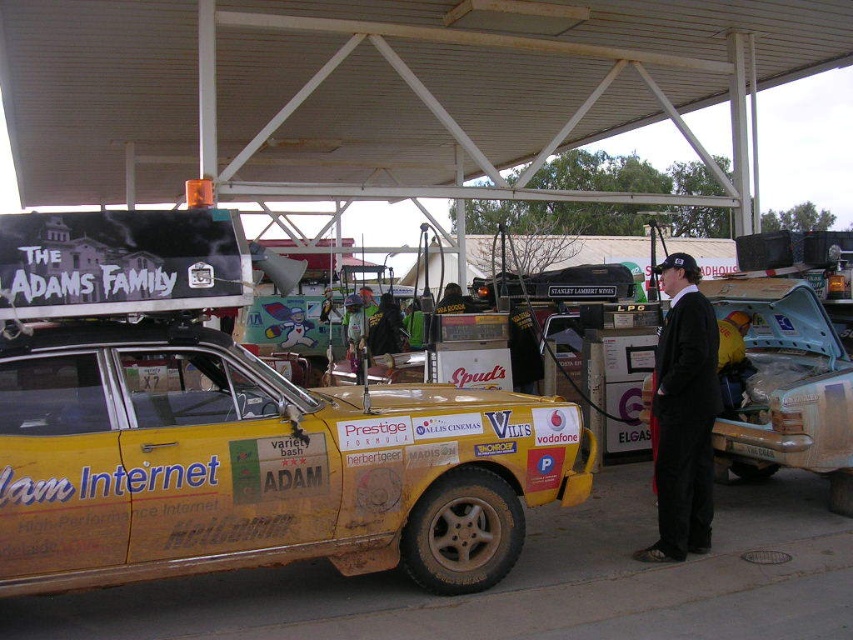
Question: Does yellow matte taxi at center have a larger size compared to rusty metal car at center?

Choices:
 (A) yes
 (B) no

Answer: (A)

Question: Among these objects, which one is farthest from the camera?

Choices:
 (A) rusty metal car at center
 (B) yellow matte taxi at center
 (C) black suit at center

Answer: (A)

Question: Estimate the real-world distances between objects in this image. Which object is closer to the black suit at center?

Choices:
 (A) yellow matte taxi at center
 (B) rusty metal car at center

Answer: (B)

Question: Does rusty metal car at center appear on the right side of black suit at center?

Choices:
 (A) yes
 (B) no

Answer: (A)

Question: Which point is closer to the camera?

Choices:
 (A) black suit at center
 (B) rusty metal car at center

Answer: (A)

Question: Can you confirm if rusty metal car at center is thinner than black suit at center?

Choices:
 (A) yes
 (B) no

Answer: (B)